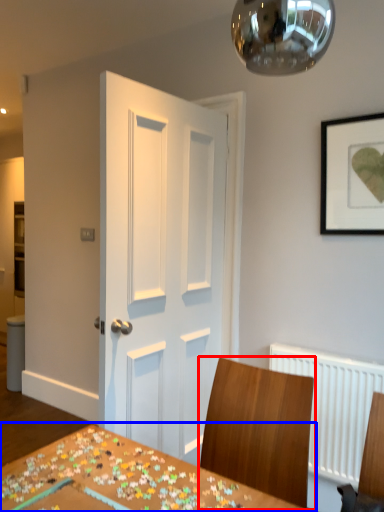
Question: Which object appears closest to the camera in this image, chair (highlighted by a red box) or table (highlighted by a blue box)?

Choices:
 (A) chair
 (B) table

Answer: (B)